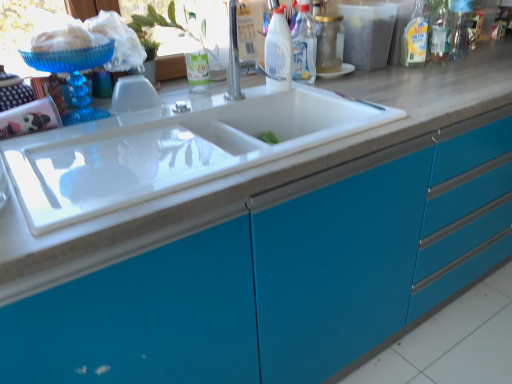
Find the location of a particular element. free space in front of clear plastic bottle at upper right is located at coordinates (425, 76).